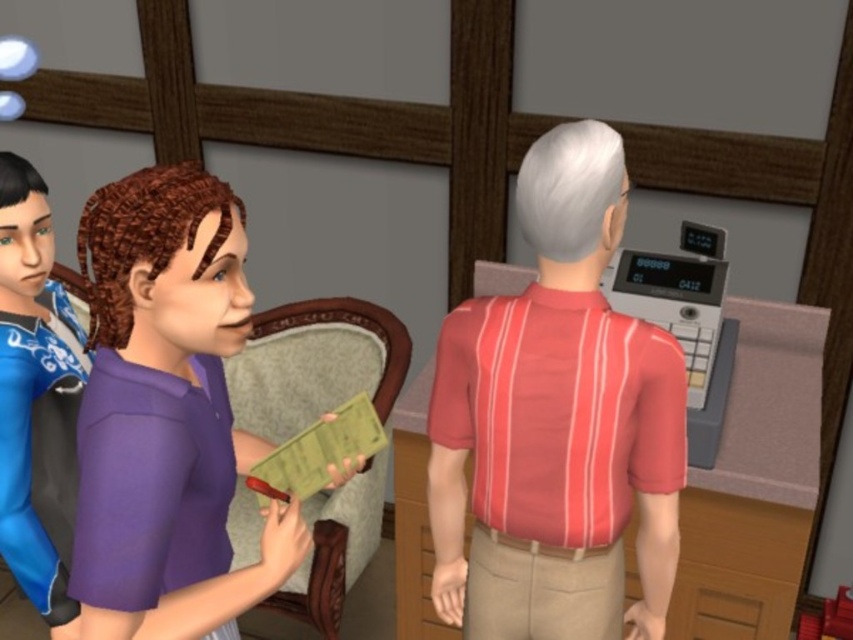
Question: Does velvet green chair at center left have a larger size compared to velvet upholstered chair at center left?

Choices:
 (A) yes
 (B) no

Answer: (A)

Question: Among these objects, which one is farthest from the camera?

Choices:
 (A) velvet upholstered chair at center left
 (B) purple matte shirt at center
 (C) red striped shirt at center

Answer: (A)

Question: In this image, where is velvet green chair at center left located relative to velvet upholstered chair at center left?

Choices:
 (A) above
 (B) below

Answer: (B)

Question: Is red striped shirt at center closer to camera compared to velvet upholstered chair at center left?

Choices:
 (A) no
 (B) yes

Answer: (B)

Question: Which of the following is the farthest from the observer?

Choices:
 (A) (595, 387)
 (B) (329, 612)
 (C) (32, 596)

Answer: (B)

Question: Which point is closer to the camera taking this photo?

Choices:
 (A) (467, 566)
 (B) (265, 348)
 (C) (194, 260)
 (D) (7, 509)

Answer: (C)